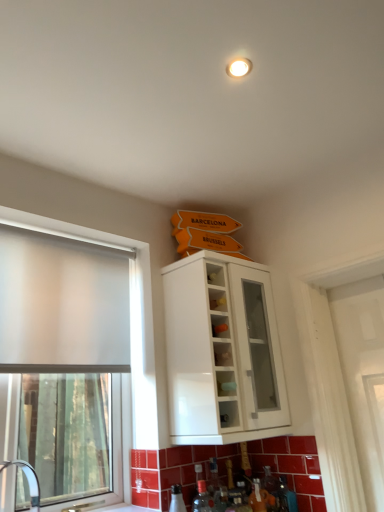
What do you see at coordinates (28, 481) in the screenshot?
I see `white glossy sink at lower left` at bounding box center [28, 481].

At what (x,y) coordinates should I click in order to perform the action: click on frosted glass window at left. Please return your answer as a coordinate pair (x, y). The width and height of the screenshot is (384, 512). Looking at the image, I should click on (66, 359).

Where is `sink below the frosted glass window at left (from the image's perspective)`? sink below the frosted glass window at left (from the image's perspective) is located at coordinates (28, 481).

From the picture: Considering the sizes of objects white glossy sink at lower left and frosted glass window at left in the image provided, who is wider, white glossy sink at lower left or frosted glass window at left?

Wider between the two is white glossy sink at lower left.

Is point (3, 463) farther from camera compared to point (114, 309)?

Yes, point (3, 463) is farther from viewer.

How distant is white glossy sink at lower left from white glossy cabinet at upper center?

white glossy sink at lower left is 2.26 meters from white glossy cabinet at upper center.

Considering the points (35, 477) and (199, 424), which point is in front, point (35, 477) or point (199, 424)?

The point (199, 424) is closer.

Considering the relative sizes of white glossy sink at lower left and white glossy cabinet at upper center in the image provided, is white glossy sink at lower left taller than white glossy cabinet at upper center?

Incorrect, the height of white glossy sink at lower left is not larger of that of white glossy cabinet at upper center.

Is white glossy sink at lower left to the right of white glossy cabinet at upper center from the viewer's perspective?

Incorrect, white glossy sink at lower left is not on the right side of white glossy cabinet at upper center.

Which is less distant, (68, 353) or (25, 461)?

Point (68, 353) is positioned closer to the camera compared to point (25, 461).

From a real-world perspective, is frosted glass window at left on top of white glossy sink at lower left?

Indeed, from a real-world perspective, frosted glass window at left stands above white glossy sink at lower left.

You are a GUI agent. You are given a task and a screenshot of the screen. Output one action in this format:
    pyautogui.click(x=<x>, y=<y>)
    Task: Click on the window positioned vertically above the white glossy sink at lower left (from a real-world perspective)
    Image resolution: width=384 pixels, height=512 pixels.
    Given the screenshot: What is the action you would take?
    pyautogui.click(x=66, y=359)

Is white glossy cabinet at upper center positioned with its back to white glossy sink at lower left?

No, white glossy cabinet at upper center's orientation is not away from white glossy sink at lower left.

Locate an element on the screen. The width and height of the screenshot is (384, 512). cabinetry above the white glossy sink at lower left (from a real-world perspective) is located at coordinates click(x=222, y=352).

How many degrees apart are the facing directions of white glossy cabinet at upper center and white glossy sink at lower left?

The facing directions of white glossy cabinet at upper center and white glossy sink at lower left are 0.343 degrees apart.

Can you tell me how much frosted glass window at left and white glossy cabinet at upper center differ in facing direction?

frosted glass window at left and white glossy cabinet at upper center are facing 0.00869 degrees away from each other.

Locate an element on the screen. Image resolution: width=384 pixels, height=512 pixels. window to the left of white glossy cabinet at upper center is located at coordinates (66, 359).

Looking at this image, would you say frosted glass window at left is a long distance from white glossy cabinet at upper center?

frosted glass window at left is far away from white glossy cabinet at upper center.

Is frosted glass window at left spatially inside white glossy cabinet at upper center, or outside of it?

frosted glass window at left lies outside white glossy cabinet at upper center.

From a real-world perspective, is white glossy cabinet at upper center above or below frosted glass window at left?

white glossy cabinet at upper center is above frosted glass window at left.

Is white glossy cabinet at upper center bigger than frosted glass window at left?

Correct, white glossy cabinet at upper center is larger in size than frosted glass window at left.

Consider the image. Is frosted glass window at left surrounded by white glossy cabinet at upper center?

That's incorrect, frosted glass window at left is not inside white glossy cabinet at upper center.

Does white glossy cabinet at upper center have a lesser height compared to frosted glass window at left?

Indeed, white glossy cabinet at upper center has a lesser height compared to frosted glass window at left.

What are the coordinates of `window above the white glossy sink at lower left (from the image's perspective)` in the screenshot? It's located at (66, 359).

Image resolution: width=384 pixels, height=512 pixels. Find the location of `sink below the white glossy cabinet at upper center (from a real-world perspective)`. sink below the white glossy cabinet at upper center (from a real-world perspective) is located at coordinates (28, 481).

When comparing their distances from white glossy sink at lower left, does white glossy cabinet at upper center or frosted glass window at left seem closer?

The object closer to white glossy sink at lower left is frosted glass window at left.

Which object lies nearer to the anchor point white glossy cabinet at upper center, white glossy sink at lower left or frosted glass window at left?

Based on the image, frosted glass window at left appears to be nearer to white glossy cabinet at upper center.

Based on their spatial positions, is white glossy sink at lower left or white glossy cabinet at upper center closer to frosted glass window at left?

white glossy sink at lower left is positioned closer to the anchor frosted glass window at left.

When comparing their distances from white glossy cabinet at upper center, does frosted glass window at left or white glossy sink at lower left seem further?

white glossy sink at lower left is positioned further to the anchor white glossy cabinet at upper center.

Considering their positions, is white glossy cabinet at upper center positioned closer to frosted glass window at left than white glossy sink at lower left?

white glossy sink at lower left lies closer to frosted glass window at left than the other object.

When comparing their distances from white glossy sink at lower left, does frosted glass window at left or white glossy cabinet at upper center seem closer?

The object closer to white glossy sink at lower left is frosted glass window at left.

Where is `sink between frosted glass window at left and white glossy cabinet at upper center in the horizontal direction`? This screenshot has height=512, width=384. sink between frosted glass window at left and white glossy cabinet at upper center in the horizontal direction is located at coordinates (28, 481).